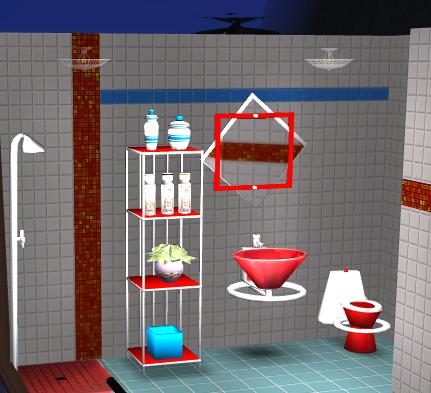
You are a GUI agent. You are given a task and a screenshot of the screen. Output one action in this format:
    pyautogui.click(x=<x>, y=<y>)
    Task: Click on the vas
    
    Given the screenshot: What is the action you would take?
    pyautogui.click(x=164, y=193)